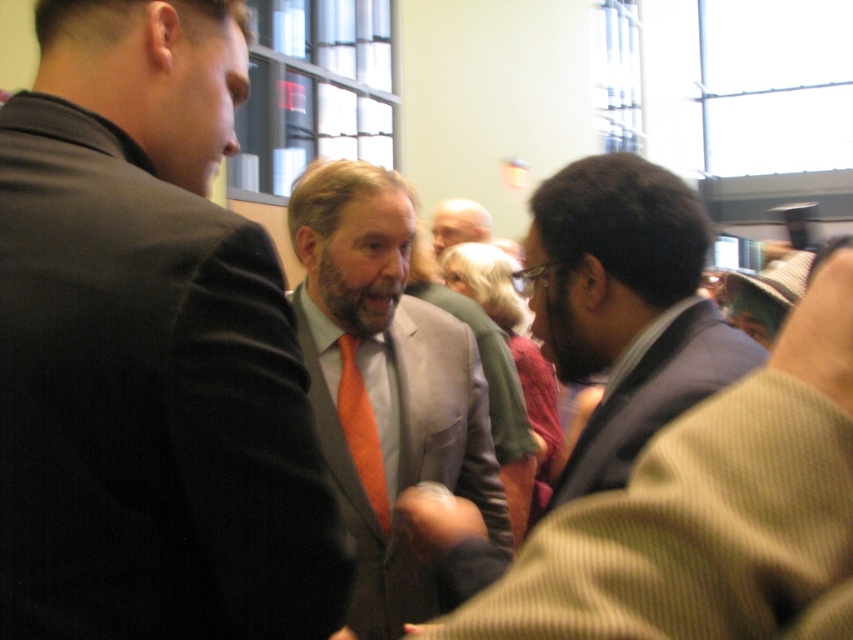
Question: Does matte gray suit at center have a greater width compared to orange silk tie at center?

Choices:
 (A) no
 (B) yes

Answer: (B)

Question: Is dark brown suit at center below orange satin tie at center?

Choices:
 (A) yes
 (B) no

Answer: (B)

Question: Which of the following is the farthest from the observer?

Choices:
 (A) orange satin tie at center
 (B) orange silk tie at center
 (C) orange tie at center

Answer: (B)

Question: Which of the following is the farthest from the observer?

Choices:
 (A) matte gray suit at center
 (B) orange tie at center
 (C) dark brown suit at center

Answer: (A)

Question: Which object appears closest to the camera in this image?

Choices:
 (A) orange satin tie at center
 (B) matte gray suit at center
 (C) dark brown suit at center

Answer: (C)

Question: Does matte gray suit at center have a lesser width compared to dark brown suit at center?

Choices:
 (A) yes
 (B) no

Answer: (B)